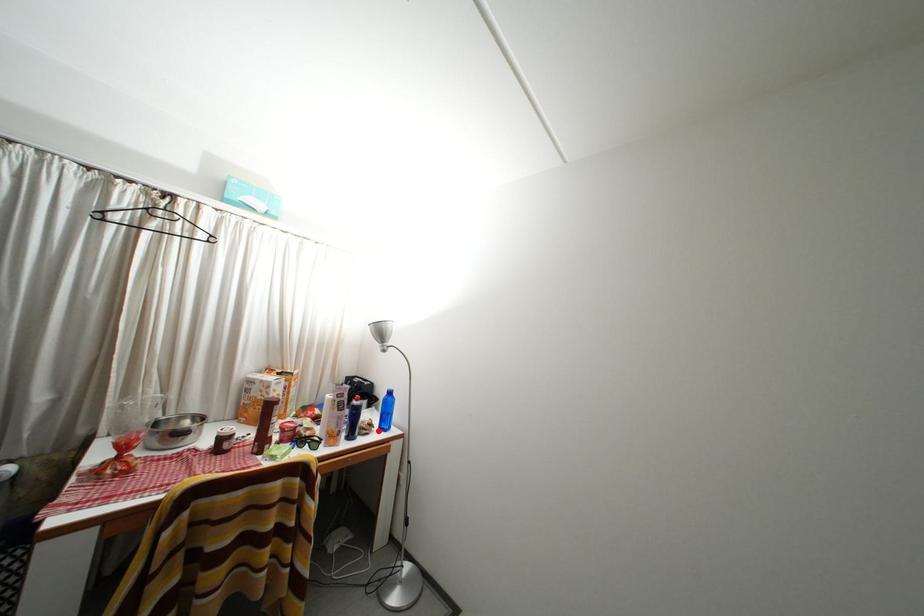
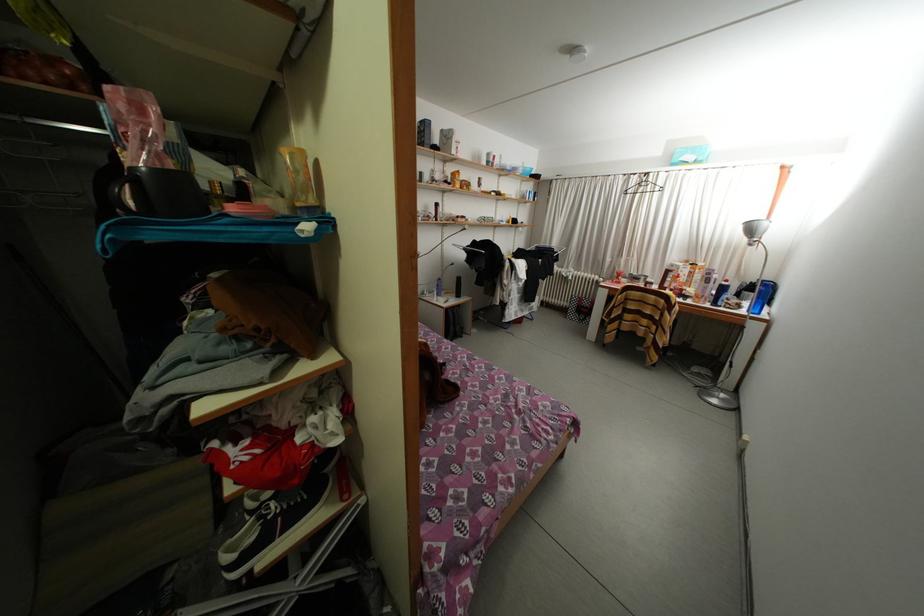
Where in the second image is the point corresponding to the highlighted location from the first image?

(747, 310)